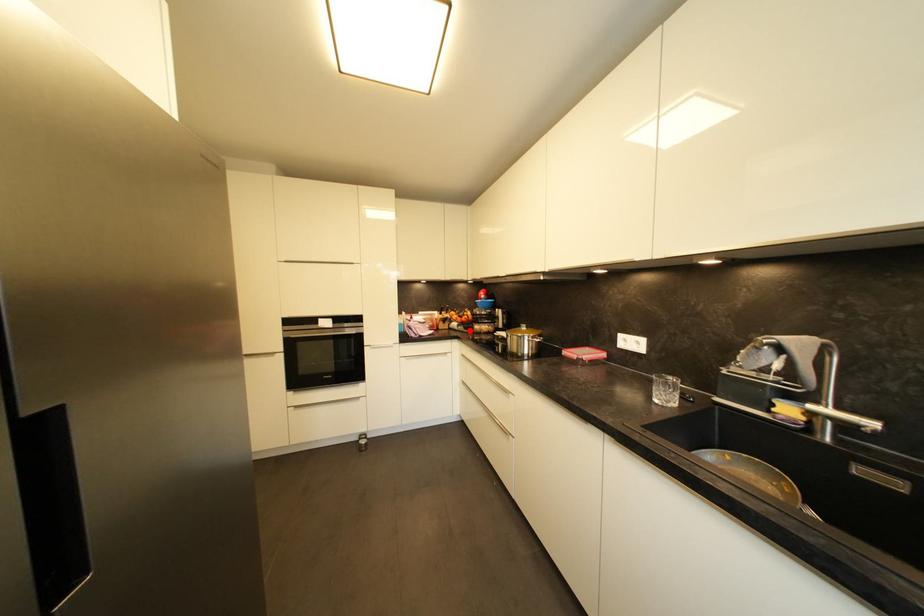
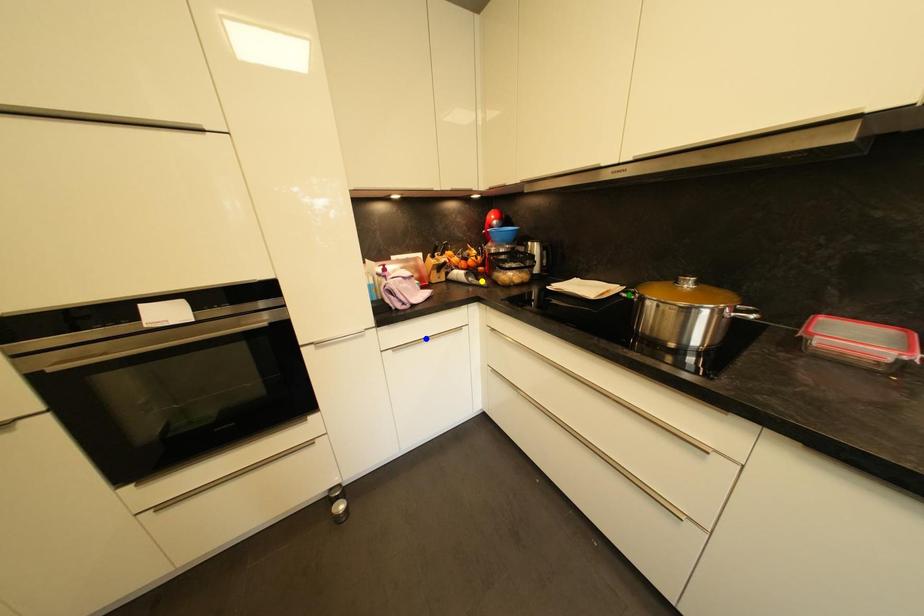
Question: I am providing you with two images of the same scene from different viewpoints. A red point is marked on the first image. You are given multiple points on the second image. Which spot in image 2 lines up with the point in image 1?

Choices:
 (A) yellow point
 (B) green point
 (C) blue point

Answer: (A)